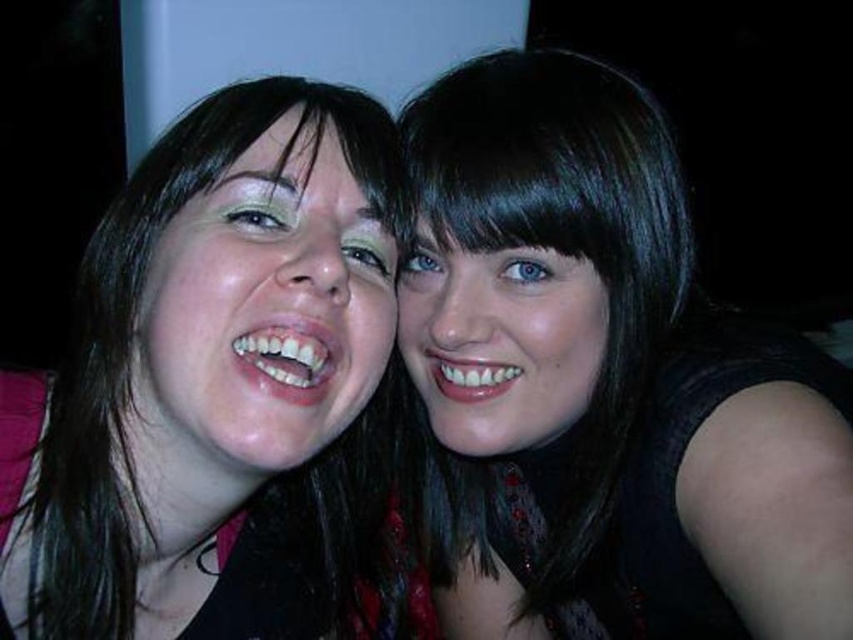
You are a photographer trying to adjust the framing of a portrait. You have two subjects in the frame. The first subject has a matte skin face at left, and the second has black matte hair at upper right. If your camera requires at least 10 inches between subjects to avoid blurring, will the current distance work?

The distance between the black matte hair at upper right and the matte skin face at left is 9.56 inches, which is less than the required 10 inches. Therefore, the current distance may cause blurring, so you should adjust the framing to increase the space between them.

You are a photographer adjusting the lighting for a portrait. You want to ensure that the matte skin face at left is evenly lit. Where should you position the light source relative to the camera to achieve this?

The matte skin face at left is located at point (262, 310). To evenly light it, position the light source directly in front of the camera, aligned with the face to avoid harsh shadows.

You are a photographer adjusting the lighting for a portrait. The subjects have black matte hair at upper right. Where should you position the light to avoid harsh shadows on their hair?

The black matte hair at upper right is located at point [602,384], so position the light directly above this coordinate to minimize shadows.